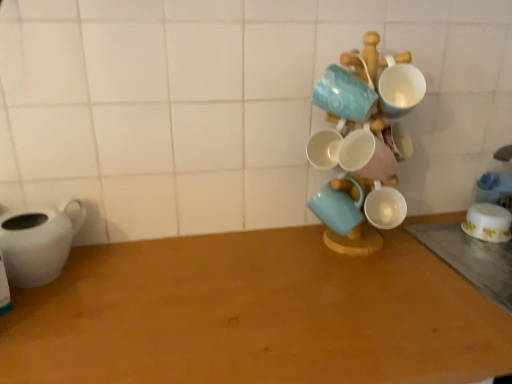
Question: Considering the relative positions of white matte teapot at left and white glossy mugs at center-right in the image provided, is white matte teapot at left to the left or to the right of white glossy mugs at center-right?

Choices:
 (A) right
 (B) left

Answer: (B)

Question: Relative to white glossy mugs at center-right, is white matte teapot at left in front or behind?

Choices:
 (A) front
 (B) behind

Answer: (B)

Question: Which object is positioned farthest from the wooden table at center, positioned as the 1th table in left-to-right order?

Choices:
 (A) white glossy bowl at right, which appears as the 1th coffee cup when viewed from the back
 (B) white glossy mugs at center-right
 (C) matte ceramic mug at center, which ranks as the 2th coffee cup in right-to-left order
 (D) white matte teapot at left
 (E) wooden table at lower right, placed as the second table when sorted from left to right

Answer: (A)

Question: Which object is the farthest from the wooden table at lower right, placed as the second table when sorted from left to right?

Choices:
 (A) matte ceramic mug at center, the second coffee cup when ordered from back to front
 (B) white matte teapot at left
 (C) white glossy bowl at right, which appears as the 1th coffee cup when viewed from the right
 (D) white glossy mugs at center-right
 (E) wooden table at center, positioned as the 2th table in right-to-left order

Answer: (B)